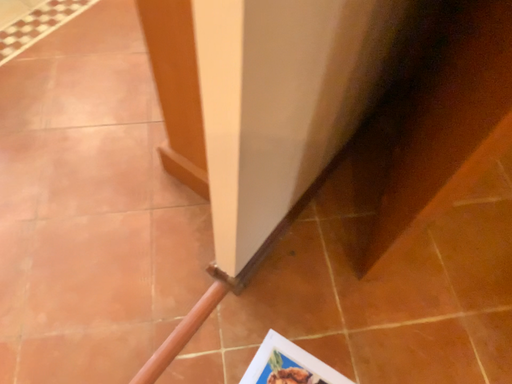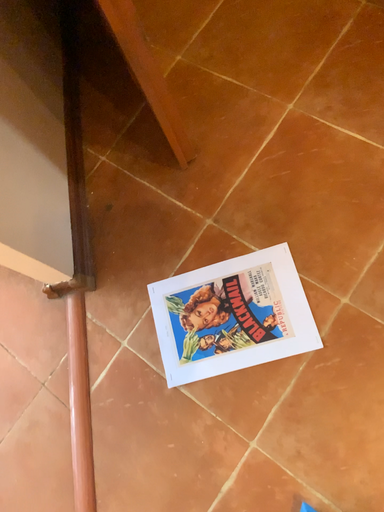
Question: How did the camera likely rotate when shooting the video?

Choices:
 (A) rotated right
 (B) rotated left

Answer: (A)